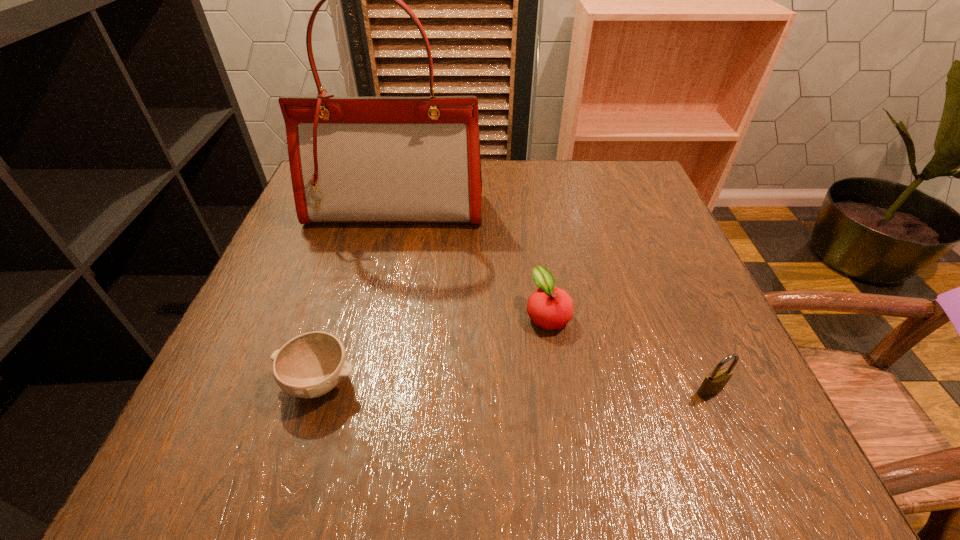
Where is `the tallest object`? The width and height of the screenshot is (960, 540). the tallest object is located at coordinates (352, 159).

The width and height of the screenshot is (960, 540). Identify the location of the farthest object. (352, 159).

Find the location of a particular element. This screenshot has width=960, height=540. the third shortest object is located at coordinates (715, 382).

At what (x,y) coordinates should I click in order to perform the action: click on the rightmost object. Please return your answer as a coordinate pair (x, y). Looking at the image, I should click on [x=715, y=382].

Where is `apple`? The width and height of the screenshot is (960, 540). apple is located at coordinates (549, 307).

The width and height of the screenshot is (960, 540). What are the coordinates of `the third object from left to right` in the screenshot? It's located at (549, 307).

In order to click on bowl in this screenshot , I will do `click(310, 365)`.

Identify the location of free spot located 0.130m on the front of the farthest object. (382, 269).

The image size is (960, 540). In order to click on vacant space situated 0.320m on the left of the padlock in this screenshot , I will do `click(493, 391)`.

The height and width of the screenshot is (540, 960). Find the location of `vacant space located 0.050m on the front of the apple`. vacant space located 0.050m on the front of the apple is located at coordinates (555, 359).